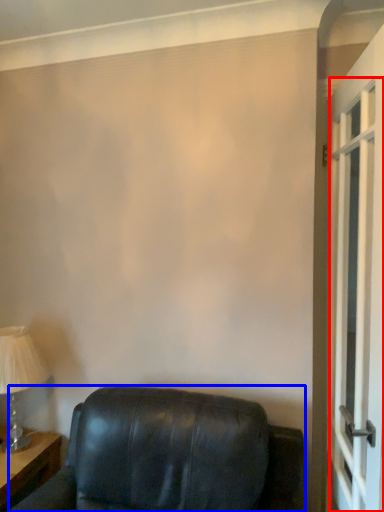
Question: Which object is closer to the camera taking this photo, screen door (highlighted by a red box) or furniture (highlighted by a blue box)?

Choices:
 (A) screen door
 (B) furniture

Answer: (B)